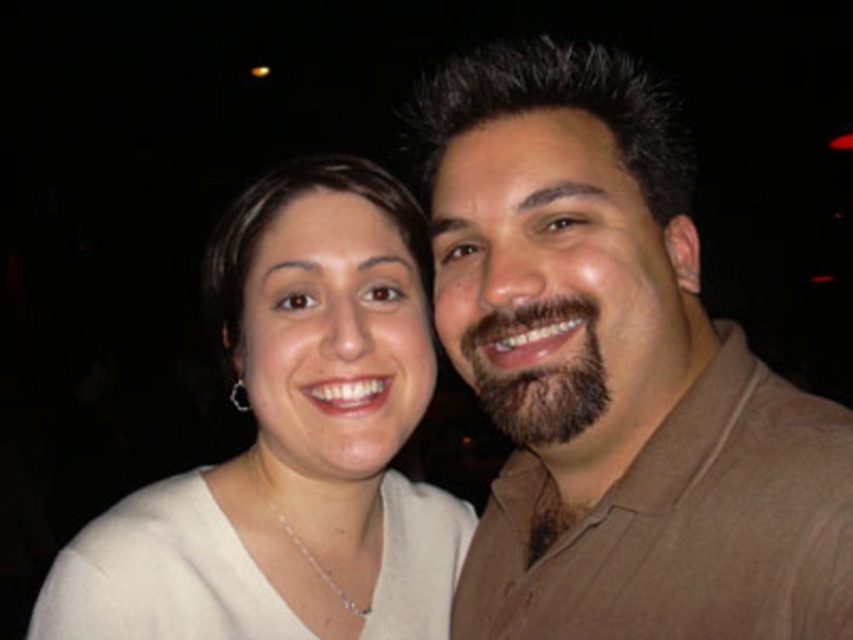
You are a photographer trying to adjust the lighting for a photo. You notice the brown cotton shirt at right and the white matte shirt at center. Which shirt should you focus your spotlight on to ensure it gets more illumination since it is higher up?

The brown cotton shirt at right is located above the white matte shirt at center, so focusing the spotlight on the brown cotton shirt at right would ensure it receives more illumination due to its higher position.

You are a photographer trying to adjust the lighting for a night photo. You have two subjects wearing a brown cotton shirt at right and a white matte shirt at center. Which subject is positioned more to the east if the light source is coming from the west?

The brown cotton shirt at right is to the right of the white matte shirt at center. Since the light source is coming from the west, the subject further east would be the one closer to the light. The white matte shirt at center is to the left of the brown cotton shirt at right, so it is positioned more to the east.

You are a photographer trying to decide where to place a new subject wearing a thick sweater in this scene. The existing subjects are wearing a brown cotton shirt at right and a white matte shirt at center. Which existing subject should the new subject stand closer to based on their clothing thickness?

The new subject should stand closer to the brown cotton shirt at right because it is thinner than the white matte shirt at center, so the thick sweater would contrast better with the thinner shirt.